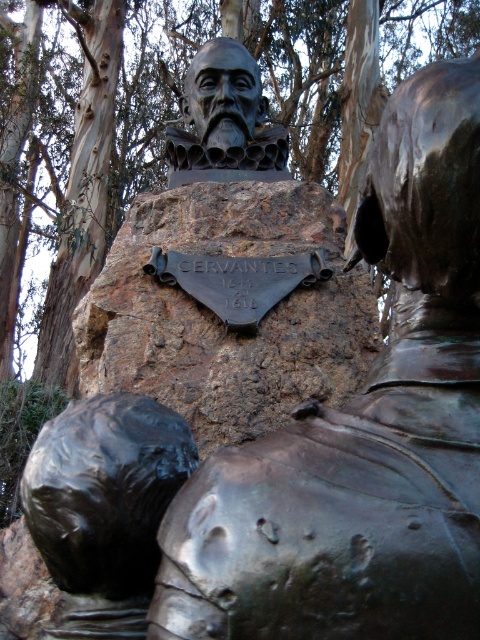
Question: From the image, what is the correct spatial relationship of brown rough stone at center in relation to shiny black helmet at lower left?

Choices:
 (A) above
 (B) below

Answer: (A)

Question: Considering the real-world distances, which object is farthest from the brown rough stone at center?

Choices:
 (A) bronze bust at center
 (B) shiny black helmet at lower left
 (C) bronze statue at center

Answer: (C)

Question: Which point is closer to the camera taking this photo?

Choices:
 (A) (189, 397)
 (B) (269, 145)
 (C) (259, 492)
 (D) (105, 420)

Answer: (C)

Question: Which point is farther to the camera?

Choices:
 (A) (375, 392)
 (B) (240, 161)
 (C) (164, 346)
 (D) (117, 618)

Answer: (B)

Question: Is bronze statue at center to the left of bronze bust at center from the viewer's perspective?

Choices:
 (A) yes
 (B) no

Answer: (B)

Question: Can you confirm if bronze statue at center is thinner than shiny black helmet at lower left?

Choices:
 (A) no
 (B) yes

Answer: (A)